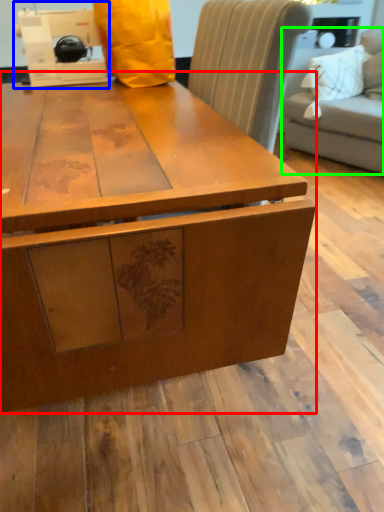
Question: Considering the real-world distances, which object is farthest from table (highlighted by a red box)? sewing machine (highlighted by a blue box) or studio couch (highlighted by a green box)?

Choices:
 (A) sewing machine
 (B) studio couch

Answer: (B)